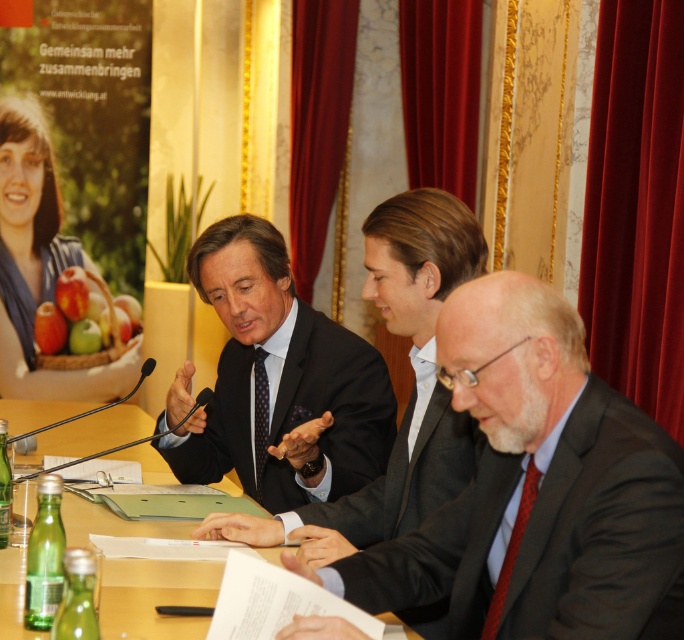
Question: Does black matte suit at lower right appear on the right side of dark blue textured suit at center?

Choices:
 (A) yes
 (B) no

Answer: (A)

Question: Where is dark blue textured suit at center located in relation to wooden table at center in the image?

Choices:
 (A) left
 (B) right

Answer: (B)

Question: Considering the real-world distances, which object is farthest from the black matte suit at lower right?

Choices:
 (A) wooden table at center
 (B) dark gray suit at center
 (C) dark blue textured suit at center

Answer: (A)

Question: Observing the image, what is the correct spatial positioning of black matte suit at lower right in reference to dark gray suit at center?

Choices:
 (A) above
 (B) below

Answer: (B)

Question: Which point appears farthest from the camera in this image?

Choices:
 (A) (140, 614)
 (B) (360, 401)

Answer: (B)

Question: Estimate the real-world distances between objects in this image. Which object is closer to the dark gray suit at center?

Choices:
 (A) wooden table at center
 (B) dark blue textured suit at center
 (C) black matte suit at lower right

Answer: (C)